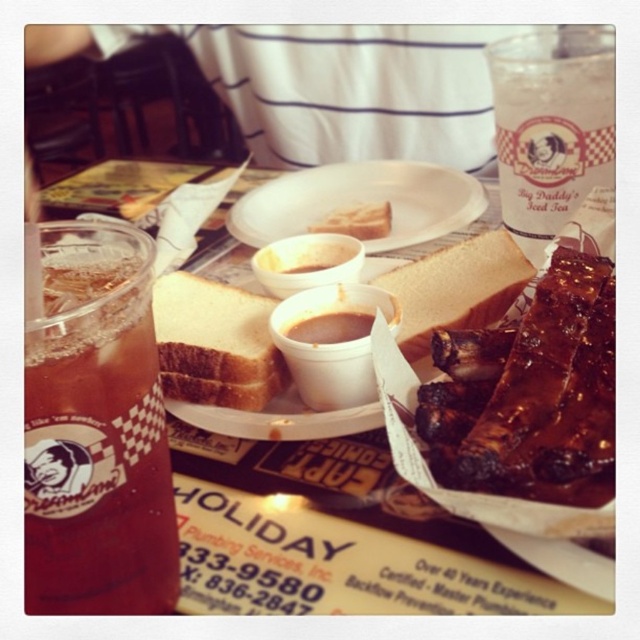
Between white matte bread at center and slightly toasted bread at center, which one appears on the right side from the viewer's perspective?

Positioned to the right is slightly toasted bread at center.

Based on the photo, which is below, white matte bread at center or slightly toasted bread at center?

white matte bread at center is below.

In the scene shown: Who is more forward, (161,282) or (492,246)?

Point (492,246) is more forward.

Identify the location of white matte bread at center. Image resolution: width=640 pixels, height=640 pixels. (214, 342).

Does translucent plastic cup at upper left come behind clear plastic cup at upper right?

That is False.

This screenshot has height=640, width=640. What do you see at coordinates (97, 432) in the screenshot?
I see `translucent plastic cup at upper left` at bounding box center [97, 432].

Where is `translucent plastic cup at upper left`? The height and width of the screenshot is (640, 640). translucent plastic cup at upper left is located at coordinates (97, 432).

Is slightly toasted bread at center thinner than smokey brown paste at center?

Incorrect, slightly toasted bread at center's width is not less than smokey brown paste at center's.

Does slightly toasted bread at center have a greater width compared to smokey brown paste at center?

Correct, the width of slightly toasted bread at center exceeds that of smokey brown paste at center.

Is point (483, 259) farther from camera compared to point (364, 323)?

That is True.

Image resolution: width=640 pixels, height=640 pixels. In order to click on slightly toasted bread at center in this screenshot , I will do `click(456, 289)`.